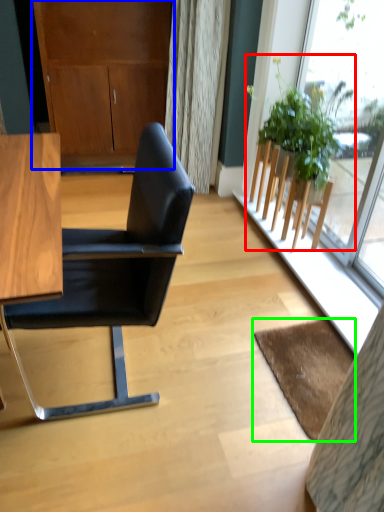
Question: Based on their relative distances, which object is farther from houseplant (highlighted by a red box)? Choose from dresser (highlighted by a blue box) and mat (highlighted by a green box).

Choices:
 (A) dresser
 (B) mat

Answer: (A)